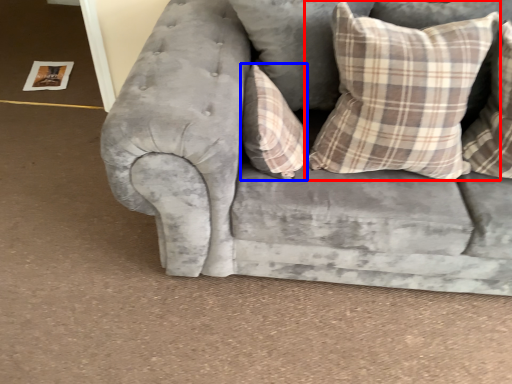
Question: Which object is further to the camera taking this photo, pillow (highlighted by a red box) or pillow (highlighted by a blue box)?

Choices:
 (A) pillow
 (B) pillow

Answer: (B)